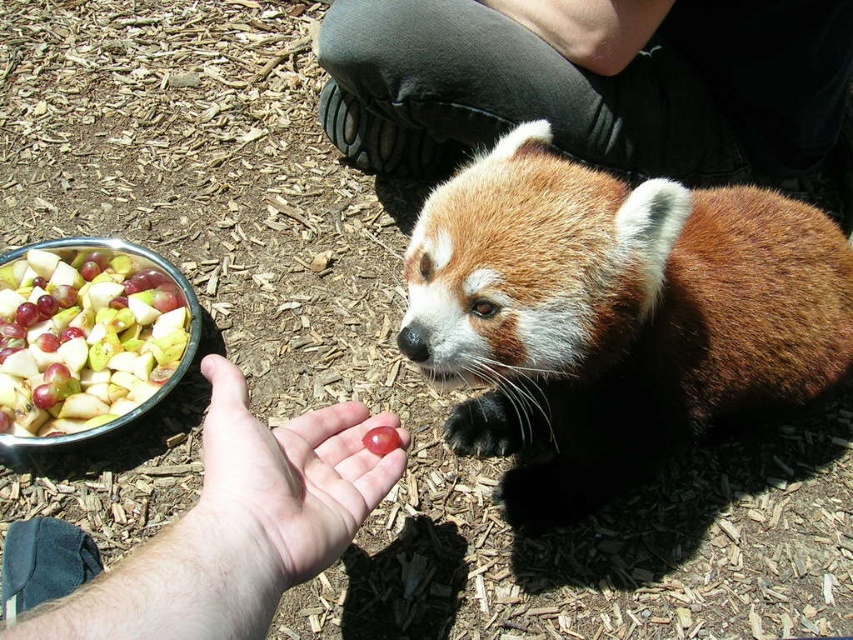
You are a wildlife photographer trying to capture a close shot of the brown fuzzy red panda at center. Your camera lens is positioned at the bottom left corner of the frame. Based on the red panda at center location, should you move your camera lens upward or downward to keep the red panda at center in the frame?

The brown fuzzy red panda at center is located at point (x=613, y=314). Since the y coordinate is 0.720, which is closer to the top of the frame, you should move the camera lens downward to keep the red panda at center in the frame.

You are a zookeeper trying to feed a red panda. You notice the brown fuzzy red panda at center and the pink skin palm at center in the image. Based on their sizes, can you estimate whether the red panda is wider than your palm?

The brown fuzzy red panda at center might be wider than pink skin palm at center.